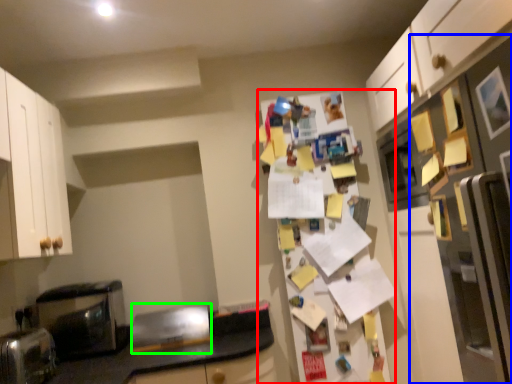
Question: Which object is positioned farthest from fridge (highlighted by a red box)? Select from fridge (highlighted by a blue box) and appliance (highlighted by a green box).

Choices:
 (A) fridge
 (B) appliance

Answer: (A)